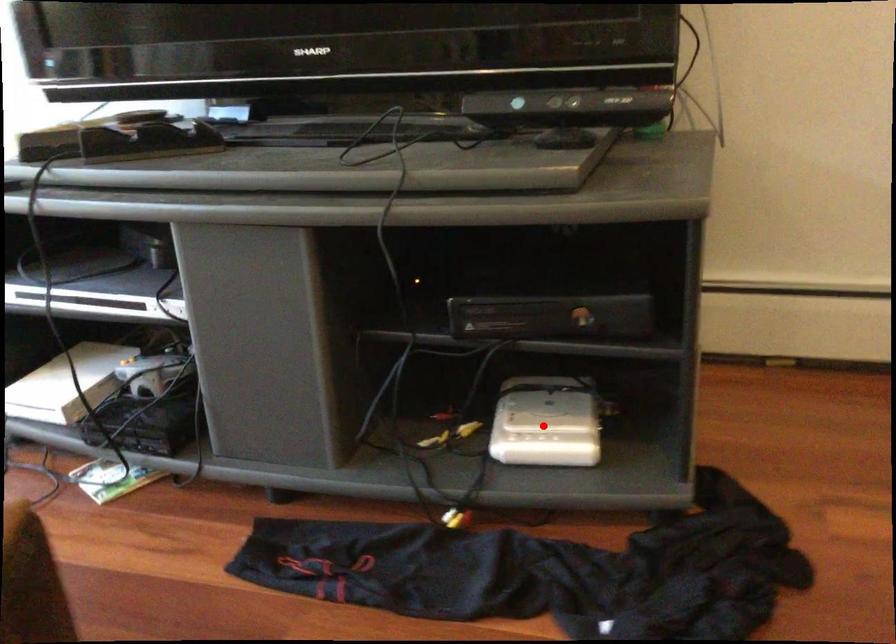
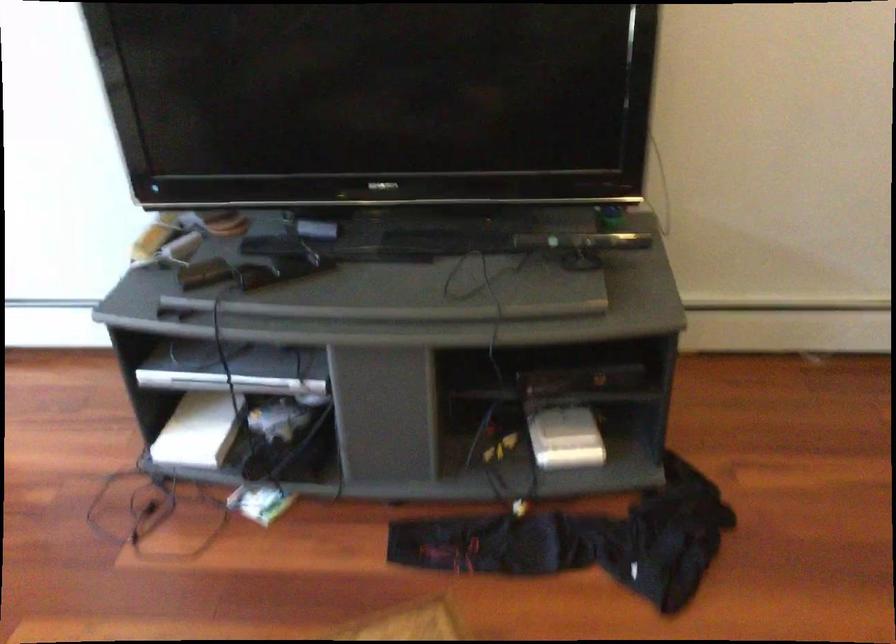
Question: I am providing you with two images of the same scene from different viewpoints. Given a red point in image1, look at the same physical point in image2. Is it:

Choices:
 (A) Closer to the viewpoint
 (B) Farther from the viewpoint

Answer: (B)